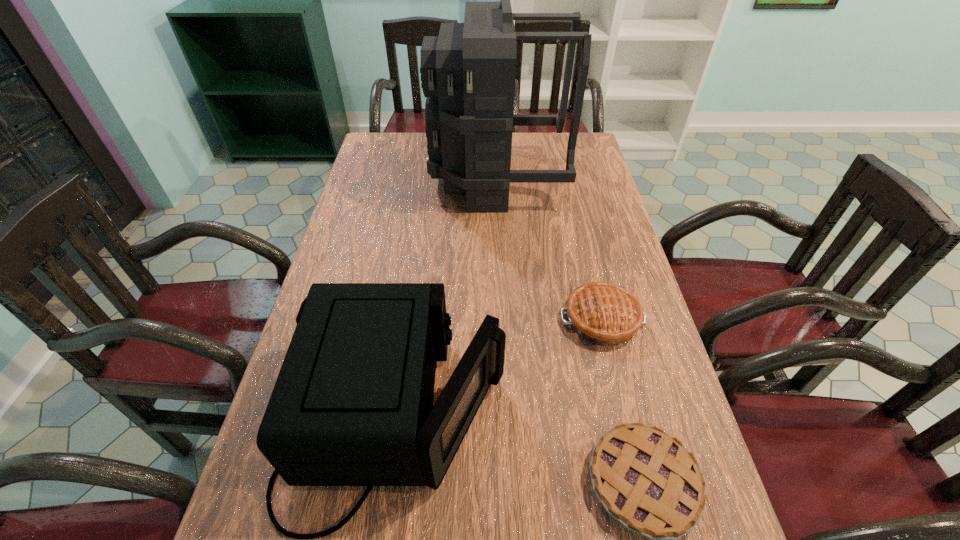
Locate an element on the screen. The height and width of the screenshot is (540, 960). object that is the third closest to the backpack is located at coordinates (647, 480).

The width and height of the screenshot is (960, 540). I want to click on object that is the third closest to the third tallest object, so click(468, 72).

Find the location of a particular element. blank space that satisfies the following two spatial constraints: 1. on the front compartment of the taller pie; 2. on the left side of the backpack is located at coordinates (504, 320).

This screenshot has height=540, width=960. In order to click on vacant space that satisfies the following two spatial constraints: 1. on the front compartment of the tallest object; 2. on the back side of the farther pie in this screenshot , I will do `click(504, 320)`.